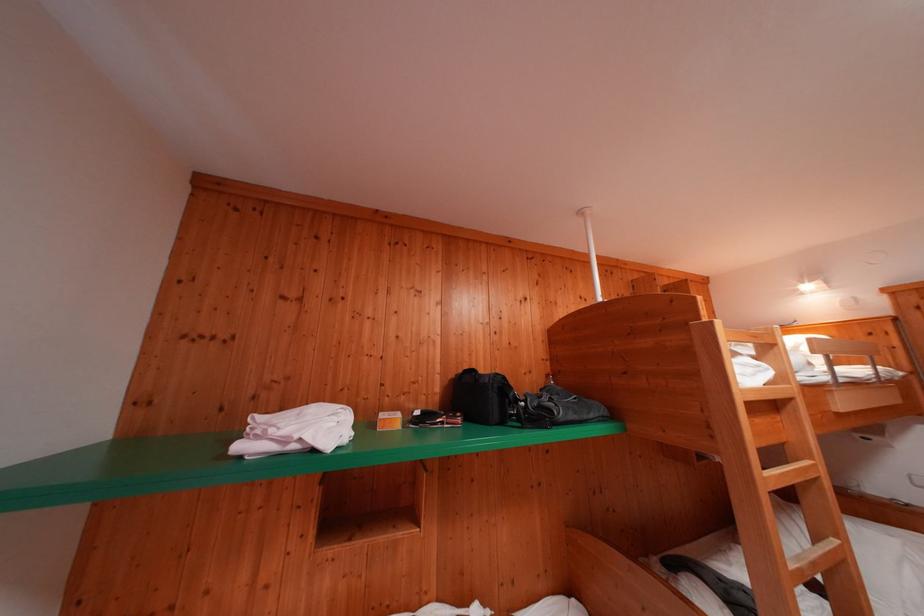
The width and height of the screenshot is (924, 616). What do you see at coordinates (794, 540) in the screenshot? I see `the wooden bed rail` at bounding box center [794, 540].